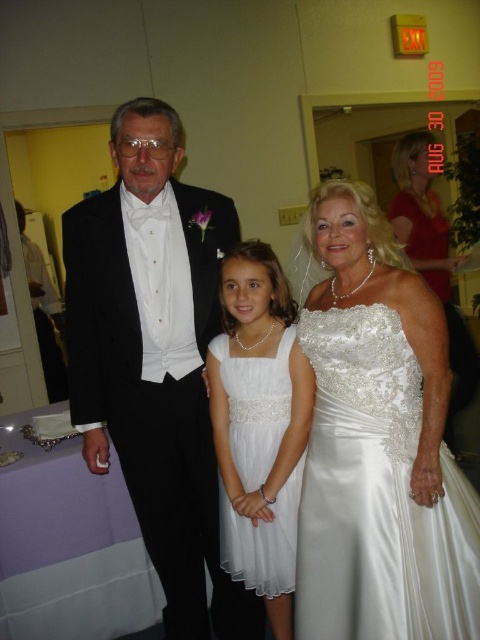
Question: Can you confirm if black satin tuxedo at left is positioned below satin/embroidered dress at center?

Choices:
 (A) no
 (B) yes

Answer: (A)

Question: Can you confirm if satin dress at center is smaller than white satin dress at center?

Choices:
 (A) yes
 (B) no

Answer: (B)

Question: Which of the following is the farthest from the observer?

Choices:
 (A) satin/embroidered dress at center
 (B) black satin tuxedo at left

Answer: (B)

Question: In this image, where is satin/embroidered dress at center located relative to white satin dress at center?

Choices:
 (A) left
 (B) right

Answer: (B)

Question: Which point is closer to the camera?

Choices:
 (A) pos(74,269)
 (B) pos(403,448)
 (C) pos(279,394)

Answer: (B)

Question: Which is nearer to the satin/embroidered dress at center?

Choices:
 (A) black satin tuxedo at left
 (B) satin dress at center
 (C) white satin dress at center

Answer: (C)